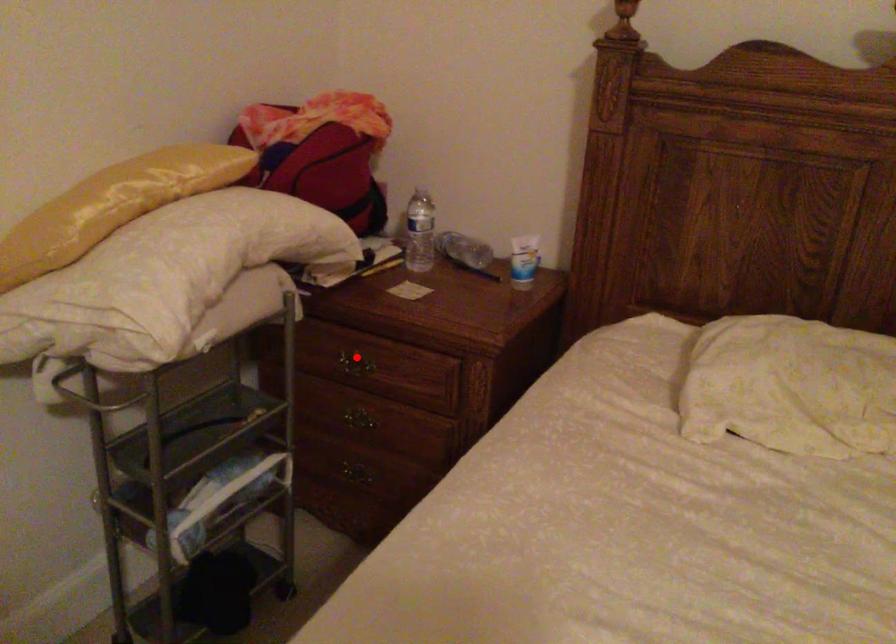
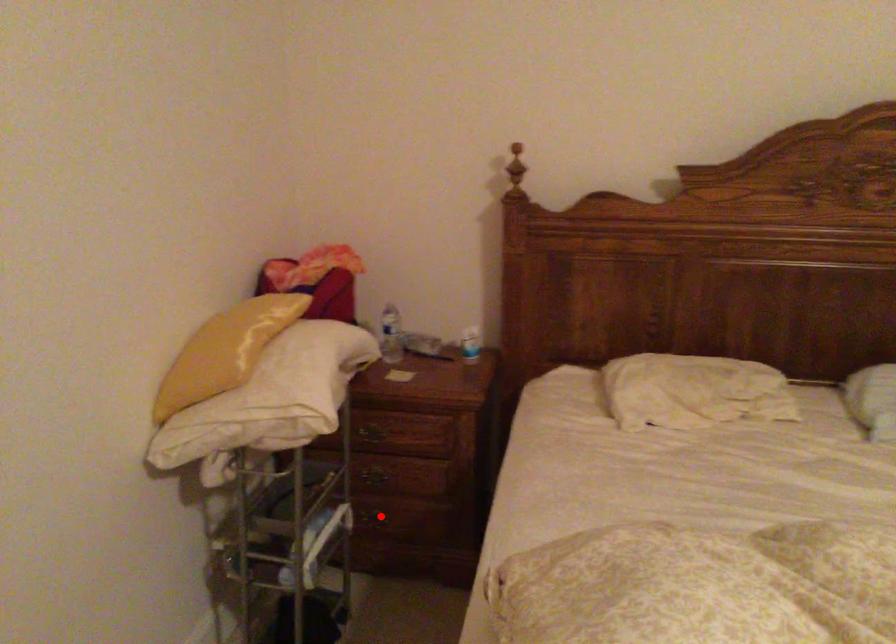
From the picture: I am providing you with two images of the same scene from different viewpoints. A red point is marked on the first image and another point is marked on the second image. Is the red point in image1 aligned with the point shown in image2?

No